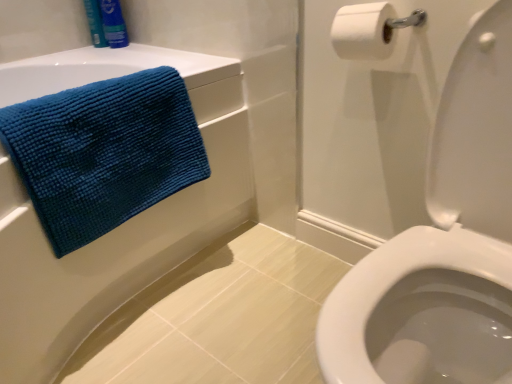
Question: Is blue fabric shampoo at upper left, positioned as the second toiletry in left-to-right order, closer to the viewer compared to blue textured towel at upper left?

Choices:
 (A) no
 (B) yes

Answer: (A)

Question: Is blue fabric shampoo at upper left, positioned as the second toiletry in left-to-right order, at the left side of blue textured towel at upper left?

Choices:
 (A) no
 (B) yes

Answer: (B)

Question: From the image's perspective, is blue fabric shampoo at upper left, the 1th toiletry in the right-to-left sequence, below blue textured towel at upper left?

Choices:
 (A) no
 (B) yes

Answer: (A)

Question: Is blue fabric shampoo at upper left, positioned as the second toiletry in left-to-right order, outside of blue textured towel at upper left?

Choices:
 (A) no
 (B) yes

Answer: (B)

Question: Is blue fabric shampoo at upper left, positioned as the second toiletry in left-to-right order, further to camera compared to blue textured towel at upper left?

Choices:
 (A) yes
 (B) no

Answer: (A)

Question: Is blue textured towel at upper left in front of or behind teal textured towel at left in the image?

Choices:
 (A) front
 (B) behind

Answer: (A)

Question: From the image's perspective, is blue textured towel at upper left positioned above or below teal textured towel at left?

Choices:
 (A) above
 (B) below

Answer: (B)

Question: From a real-world perspective, is blue textured towel at upper left positioned above or below teal textured towel at left?

Choices:
 (A) below
 (B) above

Answer: (A)

Question: Based on their positions, is blue textured towel at upper left located to the left or right of teal textured towel at left?

Choices:
 (A) right
 (B) left

Answer: (B)

Question: Considering the positions of teal textured towel at left and white matte toilet paper at upper right in the image, is teal textured towel at left taller or shorter than white matte toilet paper at upper right?

Choices:
 (A) tall
 (B) short

Answer: (A)

Question: Is point (188, 117) closer or farther from the camera than point (364, 54)?

Choices:
 (A) closer
 (B) farther

Answer: (B)

Question: In the image, is teal textured towel at left positioned in front of or behind white matte toilet paper at upper right?

Choices:
 (A) front
 (B) behind

Answer: (A)

Question: From the image's perspective, is teal textured towel at left located above or below white matte toilet paper at upper right?

Choices:
 (A) below
 (B) above

Answer: (A)

Question: Considering the positions of white matte toilet paper at upper right and blue matte shampoo at upper left, the 2th toiletry from the right, in the image, is white matte toilet paper at upper right taller or shorter than blue matte shampoo at upper left, the 2th toiletry from the right,?

Choices:
 (A) short
 (B) tall

Answer: (A)

Question: In the image, is white matte toilet paper at upper right on the left side or the right side of blue matte shampoo at upper left, marked as the 1th toiletry in a left-to-right arrangement?

Choices:
 (A) right
 (B) left

Answer: (A)